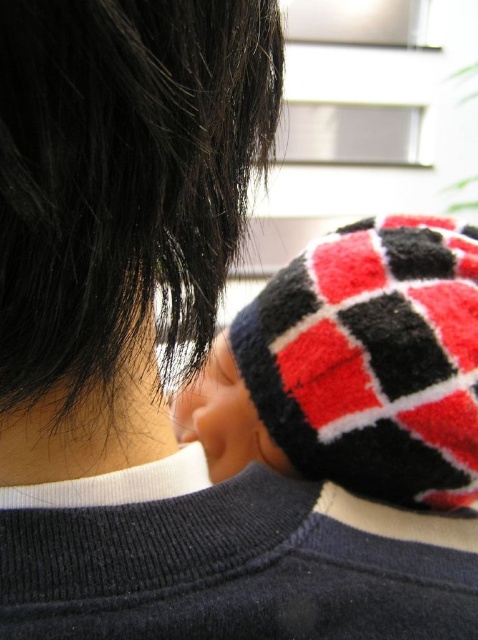
Is shiny dark hair at upper left to the left of knitted wool hat at upper right from the viewer's perspective?

Yes, shiny dark hair at upper left is to the left of knitted wool hat at upper right.

Can you confirm if shiny dark hair at upper left is wider than knitted wool hat at upper right?

Incorrect, shiny dark hair at upper left's width does not surpass knitted wool hat at upper right's.

Image resolution: width=478 pixels, height=640 pixels. What do you see at coordinates (118, 211) in the screenshot? I see `shiny dark hair at upper left` at bounding box center [118, 211].

Identify the location of shiny dark hair at upper left. (118, 211).